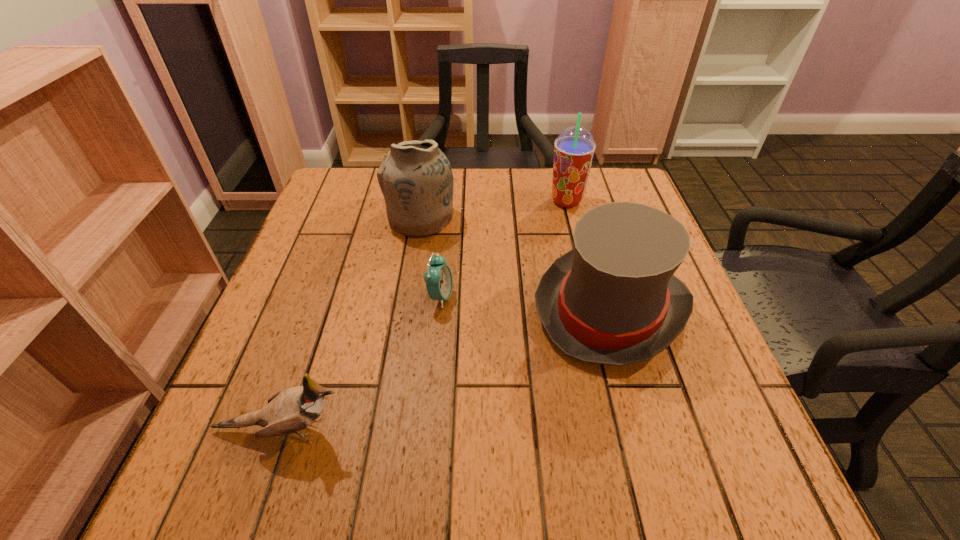
Locate an element on the screen. The image size is (960, 540). smoothie is located at coordinates (574, 149).

At what (x,y) coordinates should I click in order to perform the action: click on pottery. Please return your answer as a coordinate pair (x, y). This screenshot has width=960, height=540. Looking at the image, I should click on (416, 179).

Find the location of `dress hat`. dress hat is located at coordinates click(613, 299).

Image resolution: width=960 pixels, height=540 pixels. I want to click on bird, so tap(290, 410).

At what (x,y) coordinates should I click in order to perform the action: click on the nearest object. Please return your answer as a coordinate pair (x, y). This screenshot has width=960, height=540. Looking at the image, I should click on (290, 410).

Where is `the shortest object`? This screenshot has width=960, height=540. the shortest object is located at coordinates (438, 277).

The image size is (960, 540). I want to click on vacant region located on the left of the smoothie, so click(419, 201).

Identify the location of vacant space situated 0.290m on the front of the pottery. (402, 334).

Identify the location of free space located on the back of the third tallest object. The image size is (960, 540). (575, 185).

Locate an element on the screen. vacant space located 0.220m at the face of the fourth tallest object is located at coordinates (488, 430).